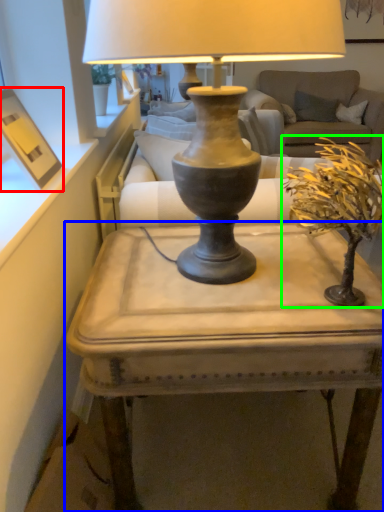
Question: Which object is positioned farthest from picture frame (highlighted by a red box)? Select from table (highlighted by a blue box) and houseplant (highlighted by a green box).

Choices:
 (A) table
 (B) houseplant

Answer: (B)